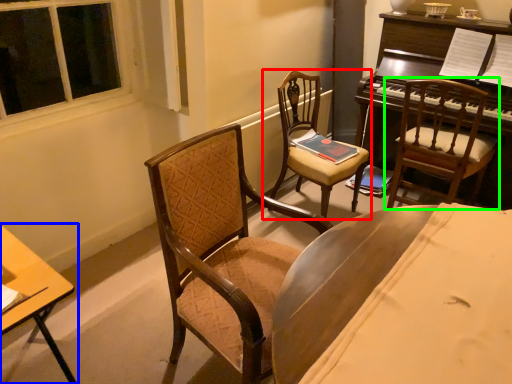
Question: Which object is positioned farthest from chair (highlighted by a red box)? Select from desk (highlighted by a blue box) and chair (highlighted by a green box).

Choices:
 (A) desk
 (B) chair

Answer: (A)